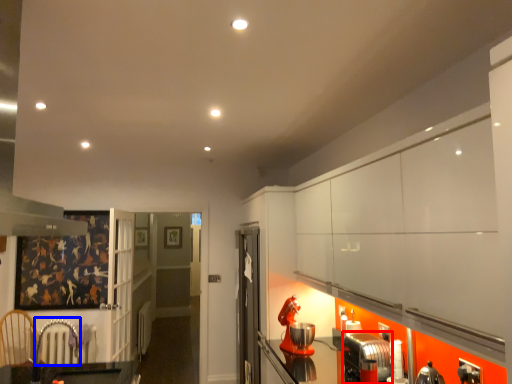
Question: Which object appears closest to the camera in this image, appliance (highlighted by a red box) or armchair (highlighted by a blue box)?

Choices:
 (A) appliance
 (B) armchair

Answer: (A)